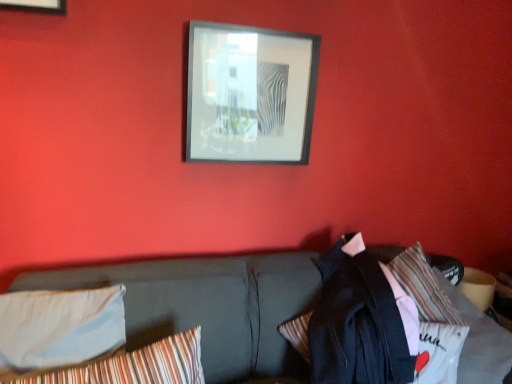
Locate an element on the screen. The image size is (512, 384). dark gray fabric couch at center is located at coordinates (208, 305).

Where is `black matte picture frame at upper center`? This screenshot has width=512, height=384. black matte picture frame at upper center is located at coordinates (250, 94).

Where is `dark gray fabric couch at center`? This screenshot has height=384, width=512. dark gray fabric couch at center is located at coordinates (208, 305).

From the image's perspective, which one is positioned lower, dark blue fabric jacket at lower right or light blue fabric pillow at lower left, the 2th pillow viewed from the right?

light blue fabric pillow at lower left, the 2th pillow viewed from the right, appears lower in the image.

Considering the positions of objects dark blue fabric jacket at lower right and light blue fabric pillow at lower left, the 2th pillow viewed from the right, in the image provided, who is more to the right, dark blue fabric jacket at lower right or light blue fabric pillow at lower left, the 2th pillow viewed from the right,?

dark blue fabric jacket at lower right.

In terms of width, does dark blue fabric jacket at lower right look wider or thinner when compared to light blue fabric pillow at lower left, the 2th pillow viewed from the right?

In the image, dark blue fabric jacket at lower right appears to be wider than light blue fabric pillow at lower left, the 2th pillow viewed from the right.

Who is bigger, dark blue fabric jacket at lower right or light blue fabric pillow at lower left, the 2th pillow viewed from the right?

With larger size is dark blue fabric jacket at lower right.

From the image's perspective, between striped fabric pillow at lower left, placed as the second pillow when sorted from left to right, and black matte picture frame at upper center, who is located below?

striped fabric pillow at lower left, placed as the second pillow when sorted from left to right, is shown below in the image.

Would you consider striped fabric pillow at lower left, placed as the second pillow when sorted from left to right, to be distant from black matte picture frame at upper center?

striped fabric pillow at lower left, placed as the second pillow when sorted from left to right, is near black matte picture frame at upper center, not far away.

Find the location of a particular element. This screenshot has width=512, height=384. picture frame on the right side of striped fabric pillow at lower left, the 1th pillow positioned from the right is located at coordinates (250, 94).

How much distance is there between striped fabric pillow at lower left, placed as the second pillow when sorted from left to right, and black matte picture frame at upper center?

A distance of 88.15 centimeters exists between striped fabric pillow at lower left, placed as the second pillow when sorted from left to right, and black matte picture frame at upper center.

Between point (266, 41) and point (324, 337), which one is positioned in front?

The point (324, 337) is closer to the camera.

Can you confirm if black matte picture frame at upper center is wider than dark blue fabric jacket at lower right?

Incorrect, the width of black matte picture frame at upper center does not surpass that of dark blue fabric jacket at lower right.

From a real-world perspective, who is located higher, black matte picture frame at upper center or dark blue fabric jacket at lower right?

From a 3D spatial view, black matte picture frame at upper center is above.

Is striped fabric pillow at lower left, the 1th pillow positioned from the right, looking in the opposite direction of light blue fabric pillow at lower left, the 2th pillow viewed from the right?

That's right, striped fabric pillow at lower left, the 1th pillow positioned from the right, is facing away from light blue fabric pillow at lower left, the 2th pillow viewed from the right.

From a real-world perspective, is striped fabric pillow at lower left, placed as the second pillow when sorted from left to right, located higher than light blue fabric pillow at lower left, the 2th pillow viewed from the right?

No, from a real-world perspective, striped fabric pillow at lower left, placed as the second pillow when sorted from left to right, is not on top of light blue fabric pillow at lower left, the 2th pillow viewed from the right.

Is point (226, 139) in front of point (147, 359)?

No.

From the image's perspective, which is above, black matte picture frame at upper center or striped fabric pillow at lower left, the 1th pillow positioned from the right?

black matte picture frame at upper center appears higher in the image.

Can you confirm if black matte picture frame at upper center is positioned to the left of striped fabric pillow at lower left, the 1th pillow positioned from the right?

Incorrect, black matte picture frame at upper center is not on the left side of striped fabric pillow at lower left, the 1th pillow positioned from the right.

Considering the positions of objects light blue fabric pillow at lower left, the 1th pillow when ordered from left to right, and striped fabric pillow at lower left, the 1th pillow positioned from the right, in the image provided, who is in front, light blue fabric pillow at lower left, the 1th pillow when ordered from left to right, or striped fabric pillow at lower left, the 1th pillow positioned from the right,?

striped fabric pillow at lower left, the 1th pillow positioned from the right, is closer to the camera.

Which is more to the left, light blue fabric pillow at lower left, the 1th pillow when ordered from left to right, or striped fabric pillow at lower left, the 1th pillow positioned from the right?

From the viewer's perspective, light blue fabric pillow at lower left, the 1th pillow when ordered from left to right, appears more on the left side.

Is light blue fabric pillow at lower left, the 2th pillow viewed from the right, wider than striped fabric pillow at lower left, placed as the second pillow when sorted from left to right?

Correct, the width of light blue fabric pillow at lower left, the 2th pillow viewed from the right, exceeds that of striped fabric pillow at lower left, placed as the second pillow when sorted from left to right.

Identify the location of studio couch below the dark blue fabric jacket at lower right (from the image's perspective). [x=208, y=305].

Is dark blue fabric jacket at lower right far away from dark gray fabric couch at center?

dark blue fabric jacket at lower right is actually quite close to dark gray fabric couch at center.

Between dark blue fabric jacket at lower right and dark gray fabric couch at center, which one appears on the left side from the viewer's perspective?

From the viewer's perspective, dark gray fabric couch at center appears more on the left side.

Which pillow is the 2nd one when counting from the left side of the dark blue fabric jacket at lower right? Please provide its 2D coordinates.

[(59, 327)]

This screenshot has height=384, width=512. What are the coordinates of `picture frame behind the striped fabric pillow at lower left, placed as the second pillow when sorted from left to right` in the screenshot? It's located at (250, 94).

Looking at the image, which one is located closer to dark gray fabric couch at center, striped fabric pillow at lower left, the 1th pillow positioned from the right, or black matte picture frame at upper center?

Among the two, striped fabric pillow at lower left, the 1th pillow positioned from the right, is located nearer to dark gray fabric couch at center.

Consider the image. Considering their positions, is dark blue fabric jacket at lower right positioned further to dark gray fabric couch at center than striped fabric pillow at lower left, placed as the second pillow when sorted from left to right?

The object further to dark gray fabric couch at center is dark blue fabric jacket at lower right.

Looking at the image, which one is located closer to black matte picture frame at upper center, dark gray fabric couch at center or dark blue fabric jacket at lower right?

Based on the image, dark gray fabric couch at center appears to be nearer to black matte picture frame at upper center.

When comparing their distances from striped fabric pillow at lower left, the 1th pillow positioned from the right, does dark gray fabric couch at center or black matte picture frame at upper center seem further?

black matte picture frame at upper center.

Looking at the image, which one is located closer to dark gray fabric couch at center, dark blue fabric jacket at lower right or light blue fabric pillow at lower left, the 2th pillow viewed from the right?

light blue fabric pillow at lower left, the 2th pillow viewed from the right, lies closer to dark gray fabric couch at center than the other object.

Looking at the image, which one is located further to black matte picture frame at upper center, dark blue fabric jacket at lower right or dark gray fabric couch at center?

Based on the image, dark blue fabric jacket at lower right appears to be further to black matte picture frame at upper center.

When comparing their distances from dark blue fabric jacket at lower right, does dark gray fabric couch at center or striped fabric pillow at lower left, the 1th pillow positioned from the right, seem closer?

The object closer to dark blue fabric jacket at lower right is dark gray fabric couch at center.

Estimate the real-world distances between objects in this image. Which object is closer to black matte picture frame at upper center, light blue fabric pillow at lower left, the 2th pillow viewed from the right, or striped fabric pillow at lower left, placed as the second pillow when sorted from left to right?

light blue fabric pillow at lower left, the 2th pillow viewed from the right.

In order to click on pillow situated between light blue fabric pillow at lower left, the 2th pillow viewed from the right, and dark blue fabric jacket at lower right from left to right in this screenshot , I will do `click(136, 365)`.

The image size is (512, 384). Find the location of `studio couch between light blue fabric pillow at lower left, the 2th pillow viewed from the right, and dark blue fabric jacket at lower right, in the horizontal direction`. studio couch between light blue fabric pillow at lower left, the 2th pillow viewed from the right, and dark blue fabric jacket at lower right, in the horizontal direction is located at coordinates (208, 305).

Locate an element on the screen. Image resolution: width=512 pixels, height=384 pixels. jacket between black matte picture frame at upper center and light blue fabric pillow at lower left, the 2th pillow viewed from the right, vertically is located at coordinates (373, 316).

At what (x,y) coordinates should I click in order to perform the action: click on pillow situated between light blue fabric pillow at lower left, the 1th pillow when ordered from left to right, and dark gray fabric couch at center from left to right. Please return your answer as a coordinate pair (x, y). The image size is (512, 384). Looking at the image, I should click on point(136,365).